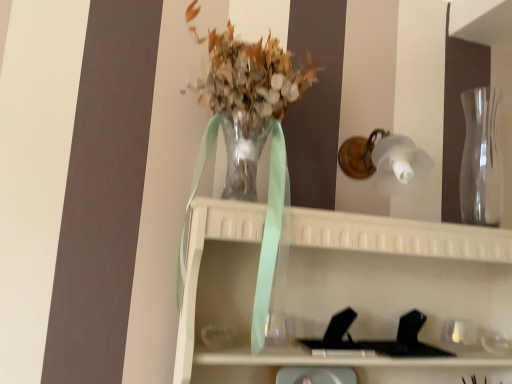
Measure the distance between point [482,105] and camera.

The distance of point [482,105] from camera is 4.61 feet.

Locate an element on the screen. This screenshot has width=512, height=384. clear glass vase at right is located at coordinates (481, 160).

In order to face clear glass vase at right, should I rotate leftwards or rightwards?

It's best to rotate right around 28.809 degrees.

What is the approximate width of clear glass vase at right?

4.96 inches.

This screenshot has width=512, height=384. What do you see at coordinates (481, 160) in the screenshot?
I see `clear glass vase at right` at bounding box center [481, 160].

This screenshot has width=512, height=384. What do you see at coordinates (252, 145) in the screenshot?
I see `translucent glass vase at center` at bounding box center [252, 145].

The width and height of the screenshot is (512, 384). What are the coordinates of `translucent glass vase at center` in the screenshot? It's located at (252, 145).

Where is `clear glass vase at right`? This screenshot has height=384, width=512. clear glass vase at right is located at coordinates (481, 160).

Considering the relative positions of translucent glass vase at center and clear glass vase at right in the image provided, is translucent glass vase at center to the left or to the right of clear glass vase at right?

From the image, it's evident that translucent glass vase at center is to the left of clear glass vase at right.

Is translucent glass vase at center positioned before clear glass vase at right?

Yes, the depth of translucent glass vase at center is less than that of clear glass vase at right.

Is point (281, 269) farther from viewer compared to point (483, 118)?

No.

From the image's perspective, does translucent glass vase at center appear higher than clear glass vase at right?

Incorrect, from the image's perspective, translucent glass vase at center is lower than clear glass vase at right.

From a real-world perspective, is translucent glass vase at center located beneath clear glass vase at right?

Correct, in the physical world, translucent glass vase at center is lower than clear glass vase at right.

Does translucent glass vase at center have a lesser width compared to clear glass vase at right?

No, translucent glass vase at center is not thinner than clear glass vase at right.

Does translucent glass vase at center have a lesser height compared to clear glass vase at right?

Incorrect, the height of translucent glass vase at center does not fall short of that of clear glass vase at right.

Considering the relative sizes of translucent glass vase at center and clear glass vase at right in the image provided, is translucent glass vase at center bigger than clear glass vase at right?

Indeed, translucent glass vase at center has a larger size compared to clear glass vase at right.

Is clear glass vase at right surrounded by translucent glass vase at center?

No, clear glass vase at right is not a part of translucent glass vase at center.

Is there a large distance between translucent glass vase at center and clear glass vase at right?

They are positioned close to each other.

Could you tell me if translucent glass vase at center is facing clear glass vase at right?

No, translucent glass vase at center is not facing towards clear glass vase at right.

Can you tell me how much translucent glass vase at center and clear glass vase at right differ in facing direction?

0.159 degrees.

Locate an element on the screen. This screenshot has width=512, height=384. glass vase positioned vertically above the translucent glass vase at center (from a real-world perspective) is located at coordinates (481, 160).

Which object is positioned more to the right, clear glass vase at right or translucent glass vase at center?

clear glass vase at right is more to the right.

Which object is more forward, clear glass vase at right or translucent glass vase at center?

translucent glass vase at center.

Does point (495, 207) come farther from viewer compared to point (304, 78)?

Yes, point (495, 207) is behind point (304, 78).

From the image's perspective, is clear glass vase at right positioned above or below translucent glass vase at center?

clear glass vase at right is above translucent glass vase at center.

From a real-world perspective, is clear glass vase at right positioned above or below translucent glass vase at center?

Clearly, from a real-world perspective, clear glass vase at right is above translucent glass vase at center.

From the picture: Between clear glass vase at right and translucent glass vase at center, which one has larger width?

translucent glass vase at center is wider.

Can you confirm if clear glass vase at right is shorter than translucent glass vase at center?

Yes.

Who is smaller, clear glass vase at right or translucent glass vase at center?

clear glass vase at right is smaller.

Is clear glass vase at right completely or partially outside of translucent glass vase at center?

Yes.

Is clear glass vase at right directly adjacent to translucent glass vase at center?

clear glass vase at right and translucent glass vase at center are not in contact.

In the scene shown: Is clear glass vase at right turned away from translucent glass vase at center?

clear glass vase at right does not have its back to translucent glass vase at center.

Identify the location of glass vase above the translucent glass vase at center (from a real-world perspective). (481, 160).

This screenshot has height=384, width=512. I want to click on floral arrangement in front of the clear glass vase at right, so click(252, 145).

This screenshot has height=384, width=512. I want to click on floral arrangement below the clear glass vase at right (from a real-world perspective), so click(x=252, y=145).